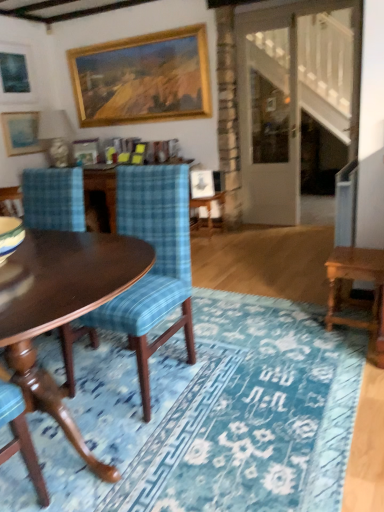
Question: Is wooden picture frame at upper center, which is the 2th picture frame in right-to-left order, turned away from blue textured rug at center?

Choices:
 (A) yes
 (B) no

Answer: (B)

Question: Considering the relative sizes of wooden picture frame at upper center, which is the 3th picture frame in left-to-right order, and blue textured rug at center in the image provided, is wooden picture frame at upper center, which is the 3th picture frame in left-to-right order, bigger than blue textured rug at center?

Choices:
 (A) no
 (B) yes

Answer: (A)

Question: Considering the relative positions of wooden picture frame at upper center, which is the 3th picture frame in left-to-right order, and blue textured rug at center in the image provided, is wooden picture frame at upper center, which is the 3th picture frame in left-to-right order, to the left of blue textured rug at center from the viewer's perspective?

Choices:
 (A) yes
 (B) no

Answer: (A)

Question: Does wooden picture frame at upper center, which is the 2th picture frame in right-to-left order, come behind blue textured rug at center?

Choices:
 (A) no
 (B) yes

Answer: (B)

Question: Is wooden picture frame at upper center, which is the 3th picture frame in left-to-right order, outside of blue textured rug at center?

Choices:
 (A) yes
 (B) no

Answer: (A)

Question: From the image's perspective, is matte black picture frame at upper left, positioned as the first picture frame in left-to-right order, positioned above or below wooden side table at center?

Choices:
 (A) above
 (B) below

Answer: (A)

Question: Relative to wooden side table at center, is matte black picture frame at upper left, positioned as the first picture frame in left-to-right order, in front or behind?

Choices:
 (A) behind
 (B) front

Answer: (A)

Question: Considering the positions of matte black picture frame at upper left, positioned as the first picture frame in left-to-right order, and wooden side table at center in the image, is matte black picture frame at upper left, positioned as the first picture frame in left-to-right order, bigger or smaller than wooden side table at center?

Choices:
 (A) big
 (B) small

Answer: (B)

Question: Would you say matte black picture frame at upper left, positioned as the first picture frame in left-to-right order, is to the left or to the right of wooden side table at center in the picture?

Choices:
 (A) right
 (B) left

Answer: (B)

Question: Considering the positions of gold-framed painting at upper center, which ranks as the 1th picture frame in right-to-left order, and blue textured rug at center in the image, is gold-framed painting at upper center, which ranks as the 1th picture frame in right-to-left order, wider or thinner than blue textured rug at center?

Choices:
 (A) thin
 (B) wide

Answer: (A)

Question: Is point (192, 116) closer or farther from the camera than point (153, 334)?

Choices:
 (A) closer
 (B) farther

Answer: (B)

Question: Is gold-framed painting at upper center, the 4th picture frame viewed from the left, in front of or behind blue textured rug at center in the image?

Choices:
 (A) behind
 (B) front

Answer: (A)

Question: In terms of size, does gold-framed painting at upper center, the 4th picture frame viewed from the left, appear bigger or smaller than blue textured rug at center?

Choices:
 (A) big
 (B) small

Answer: (B)

Question: In terms of size, does blue plaid fabric chair at left appear bigger or smaller than wooden table at right?

Choices:
 (A) small
 (B) big

Answer: (B)

Question: Does point (145, 211) appear closer or farther from the camera than point (345, 324)?

Choices:
 (A) farther
 (B) closer

Answer: (B)